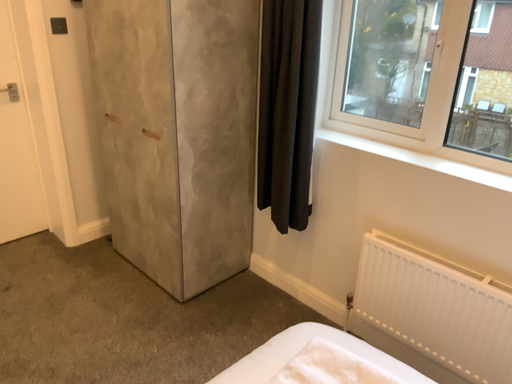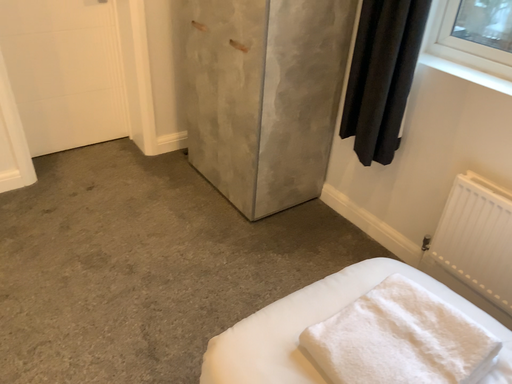
Question: How did the camera likely rotate when shooting the video?

Choices:
 (A) rotated right
 (B) rotated left

Answer: (B)